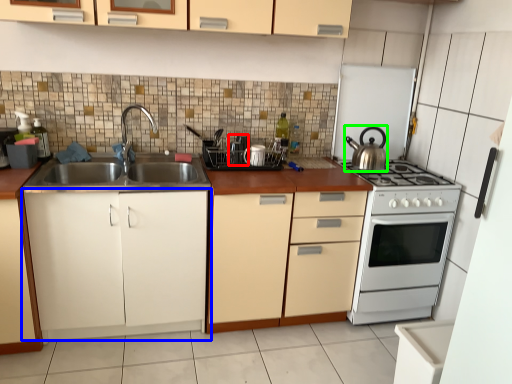
Question: Which object is positioned farthest from appliance (highlighted by a red box)? Select from cabinetry (highlighted by a blue box) and kitchen appliance (highlighted by a green box).

Choices:
 (A) cabinetry
 (B) kitchen appliance

Answer: (B)